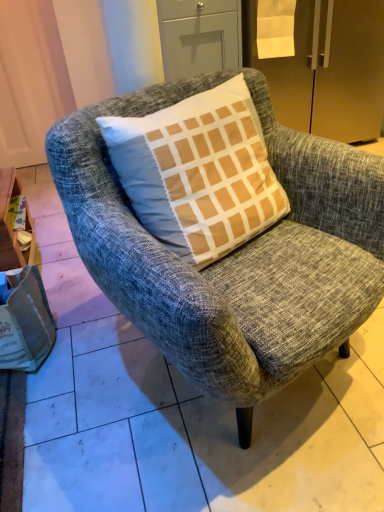
Question: Should I look upward or downward to see wooden at left?

Choices:
 (A) down
 (B) up

Answer: (B)

Question: From a real-world perspective, is wooden at left under white paper bag at lower left?

Choices:
 (A) yes
 (B) no

Answer: (B)

Question: Is wooden at left smaller than white paper bag at lower left?

Choices:
 (A) no
 (B) yes

Answer: (A)

Question: Does wooden at left have a lesser height compared to white paper bag at lower left?

Choices:
 (A) no
 (B) yes

Answer: (A)

Question: Considering the relative sizes of wooden at left and white paper bag at lower left in the image provided, is wooden at left bigger than white paper bag at lower left?

Choices:
 (A) no
 (B) yes

Answer: (B)

Question: From the image's perspective, is wooden at left located above white paper bag at lower left?

Choices:
 (A) no
 (B) yes

Answer: (B)

Question: Would you say white paper bag at lower left is part of wooden at left's contents?

Choices:
 (A) no
 (B) yes

Answer: (A)

Question: Is satin gold refrigerator at upper right bigger than wooden at left?

Choices:
 (A) no
 (B) yes

Answer: (B)

Question: From the image's perspective, would you say satin gold refrigerator at upper right is positioned over wooden at left?

Choices:
 (A) no
 (B) yes

Answer: (B)

Question: From a real-world perspective, does satin gold refrigerator at upper right sit lower than wooden at left?

Choices:
 (A) yes
 (B) no

Answer: (B)

Question: Does satin gold refrigerator at upper right turn towards wooden at left?

Choices:
 (A) yes
 (B) no

Answer: (B)

Question: Can you confirm if satin gold refrigerator at upper right is thinner than wooden at left?

Choices:
 (A) no
 (B) yes

Answer: (A)

Question: Is satin gold refrigerator at upper right turned away from wooden at left?

Choices:
 (A) yes
 (B) no

Answer: (B)

Question: Can you confirm if matte gray drawer at upper center is smaller than textured gray armchair at center?

Choices:
 (A) no
 (B) yes

Answer: (B)